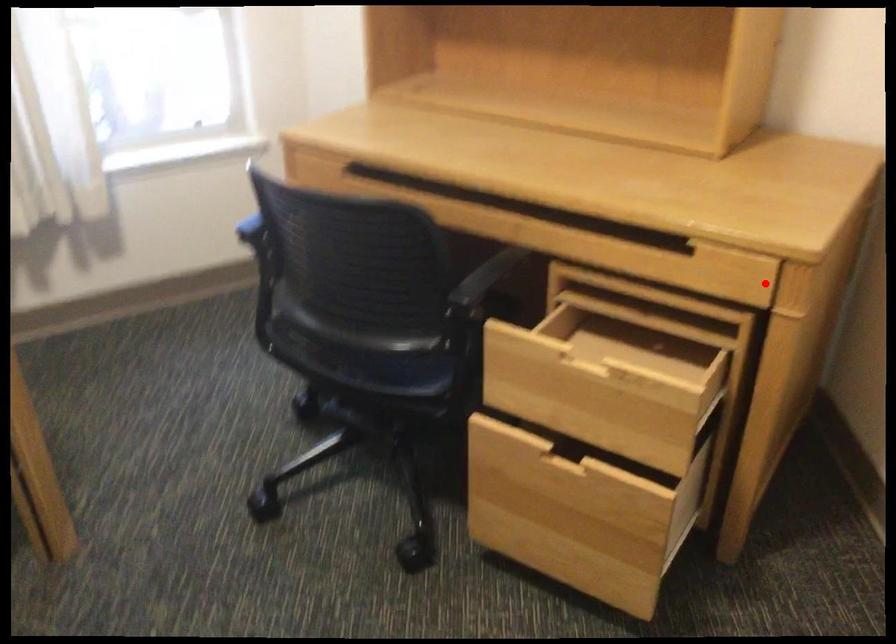
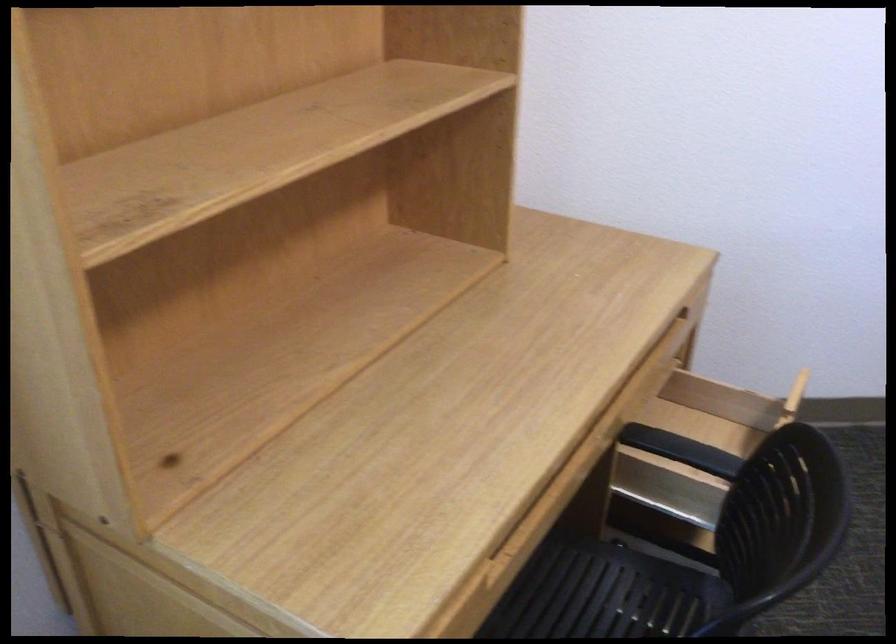
Question: I am providing you with two images of the same scene from different viewpoints. In image1, a red point is highlighted. Considering the same 3D point in image2, which of the following is correct?

Choices:
 (A) It is closer
 (B) It is farther

Answer: (B)